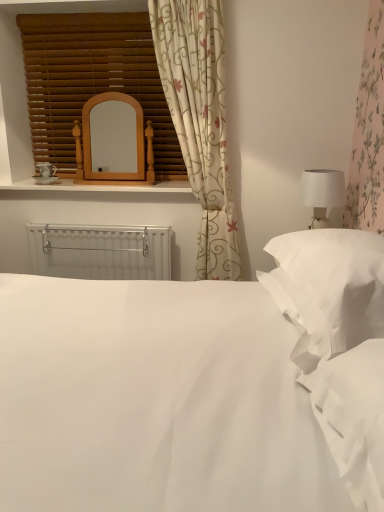
Question: Does white plastic radiator at center have a smaller size compared to white soft pillow at right?

Choices:
 (A) yes
 (B) no

Answer: (A)

Question: Is white plastic radiator at center to the left of white soft pillow at right from the viewer's perspective?

Choices:
 (A) yes
 (B) no

Answer: (A)

Question: Is white plastic radiator at center at the right side of white soft pillow at right?

Choices:
 (A) yes
 (B) no

Answer: (B)

Question: Is white plastic radiator at center positioned beyond the bounds of white soft pillow at right?

Choices:
 (A) yes
 (B) no

Answer: (A)

Question: From a real-world perspective, is white plastic radiator at center physically below white soft pillow at right?

Choices:
 (A) no
 (B) yes

Answer: (B)

Question: In terms of size, does white soft pillow at right appear bigger or smaller than white matte table lamp at right?

Choices:
 (A) big
 (B) small

Answer: (A)

Question: Would you say white soft pillow at right is to the left or to the right of white matte table lamp at right in the picture?

Choices:
 (A) left
 (B) right

Answer: (A)

Question: Which is correct: white soft pillow at right is inside white matte table lamp at right, or outside of it?

Choices:
 (A) inside
 (B) outside

Answer: (B)

Question: In the image, is white soft pillow at right positioned in front of or behind white matte table lamp at right?

Choices:
 (A) front
 (B) behind

Answer: (A)

Question: Considering the positions of woodenmaterial/texturewindow sill at upper center and white smooth bed at center in the image, is woodenmaterial/texturewindow sill at upper center wider or thinner than white smooth bed at center?

Choices:
 (A) thin
 (B) wide

Answer: (A)

Question: Visually, is woodenmaterial/texturewindow sill at upper center positioned to the left or to the right of white smooth bed at center?

Choices:
 (A) right
 (B) left

Answer: (B)

Question: From a real-world perspective, is woodenmaterial/texturewindow sill at upper center above or below white smooth bed at center?

Choices:
 (A) below
 (B) above

Answer: (A)

Question: Would you say woodenmaterial/texturewindow sill at upper center is inside or outside white smooth bed at center?

Choices:
 (A) inside
 (B) outside

Answer: (B)

Question: Considering the positions of white smooth bed at center and white soft pillow at right in the image, is white smooth bed at center wider or thinner than white soft pillow at right?

Choices:
 (A) thin
 (B) wide

Answer: (B)

Question: From a real-world perspective, is white smooth bed at center positioned above or below white soft pillow at right?

Choices:
 (A) below
 (B) above

Answer: (B)